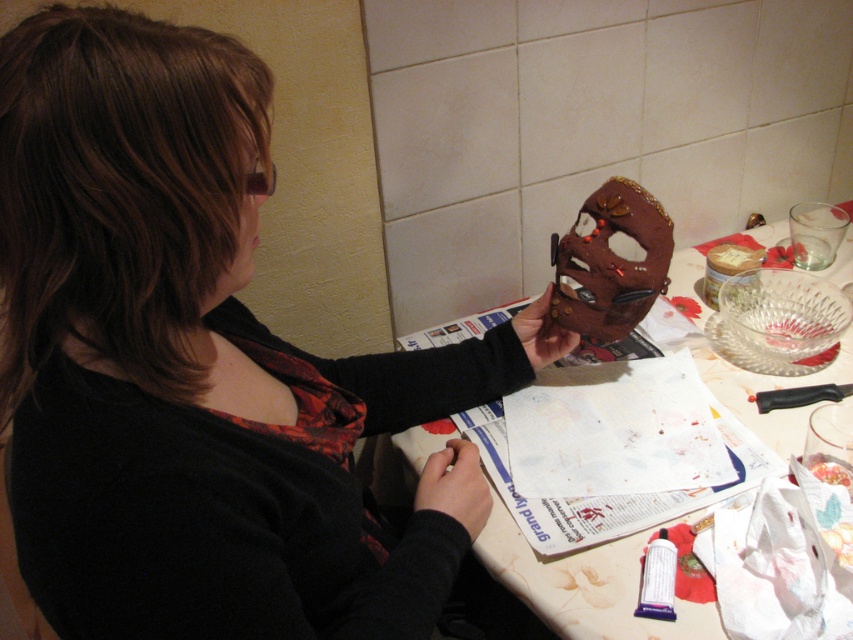
How much distance is there between matte brown mask at upper right and matte brown mask at center?

matte brown mask at upper right is 13.22 inches from matte brown mask at center.

Does matte brown mask at upper right appear on the left side of matte brown mask at center?

Yes, matte brown mask at upper right is to the left of matte brown mask at center.

Identify the location of matte brown mask at upper right. (193, 353).

Find the location of a particular element. matte brown mask at upper right is located at coordinates (193, 353).